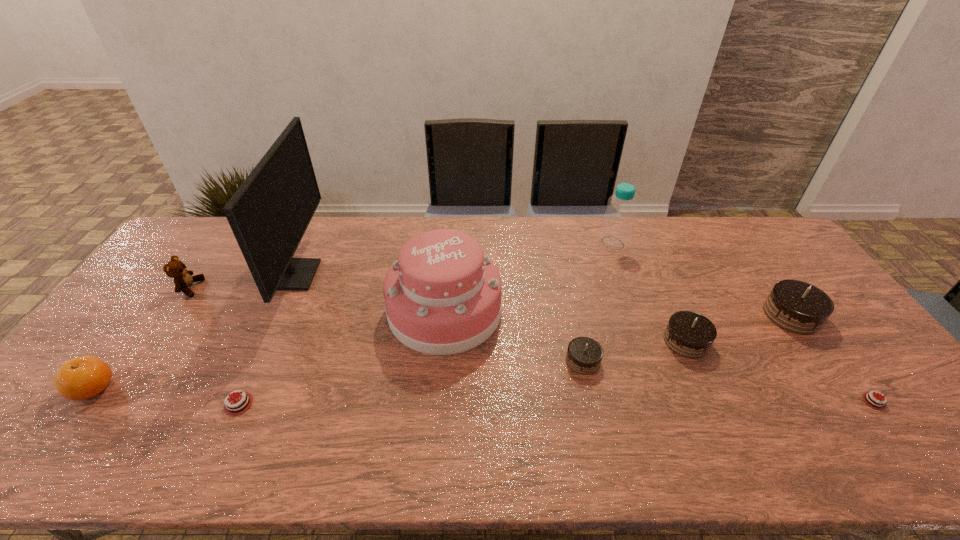
At what (x,y) coordinates should I click in order to perform the action: click on the fifth object from right to left. Please return your answer as a coordinate pair (x, y). Image resolution: width=960 pixels, height=540 pixels. Looking at the image, I should click on (584, 355).

This screenshot has width=960, height=540. In order to click on the leftmost chocolate chocolate cake in this screenshot , I will do `click(584, 355)`.

Where is `the second shortest object`? The height and width of the screenshot is (540, 960). the second shortest object is located at coordinates (238, 405).

In order to click on the bigger red chocolate cake in this screenshot , I will do `click(238, 405)`.

I want to click on the right red chocolate cake, so click(870, 398).

The width and height of the screenshot is (960, 540). I want to click on the shortest object, so click(870, 398).

This screenshot has width=960, height=540. In order to click on free region located 0.300m on the front-facing side of the tallest object in this screenshot , I will do `click(409, 275)`.

You are a GUI agent. You are given a task and a screenshot of the screen. Output one action in this format:
    pyautogui.click(x=<x>, y=<y>)
    Task: Click on the free space located 0.360m on the left of the blue bottle
    Image resolution: width=960 pixels, height=540 pixels.
    Given the screenshot: What is the action you would take?
    pyautogui.click(x=496, y=243)

Identify the location of vacant space located 0.140m on the left of the pink birthday cake. This screenshot has width=960, height=540. (341, 310).

You are a GUI agent. You are given a task and a screenshot of the screen. Output one action in this format:
    pyautogui.click(x=<x>, y=<y>)
    Task: Click on the free space located 0.300m on the left of the tallest chocolate cake
    
    Given the screenshot: What is the action you would take?
    pyautogui.click(x=663, y=315)